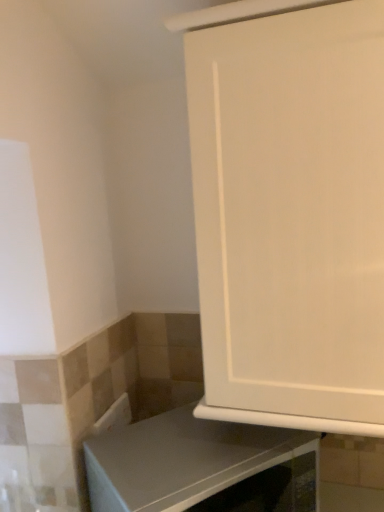
The width and height of the screenshot is (384, 512). What do you see at coordinates (201, 466) in the screenshot? I see `gray matte countertop at lower center` at bounding box center [201, 466].

Where is `gray matte countertop at lower center`? gray matte countertop at lower center is located at coordinates (201, 466).

What do you see at coordinates (289, 211) in the screenshot?
I see `white matte cabinet at center` at bounding box center [289, 211].

Where is `white matte cabinet at center`? The width and height of the screenshot is (384, 512). white matte cabinet at center is located at coordinates (289, 211).

This screenshot has width=384, height=512. Identify the location of gray matte countertop at lower center. (201, 466).

Considering the relative positions of gray matte countertop at lower center and white matte cabinet at center in the image provided, is gray matte countertop at lower center to the left or to the right of white matte cabinet at center?

Clearly, gray matte countertop at lower center is on the left of white matte cabinet at center in the image.

Does gray matte countertop at lower center come behind white matte cabinet at center?

Yes.

Does point (140, 481) come in front of point (268, 376)?

Yes, point (140, 481) is in front of point (268, 376).

From the image's perspective, is gray matte countertop at lower center on top of white matte cabinet at center?

No, from the image's perspective, gray matte countertop at lower center is not over white matte cabinet at center.

From a real-world perspective, is gray matte countertop at lower center positioned above or below white matte cabinet at center?

Clearly, from a real-world perspective, gray matte countertop at lower center is below white matte cabinet at center.

Does gray matte countertop at lower center have a greater width compared to white matte cabinet at center?

No.

Which of these two, gray matte countertop at lower center or white matte cabinet at center, stands taller?

white matte cabinet at center.

Can you confirm if gray matte countertop at lower center is smaller than white matte cabinet at center?

Yes, gray matte countertop at lower center is smaller than white matte cabinet at center.

Is white matte cabinet at center inside gray matte countertop at lower center?

No, gray matte countertop at lower center does not contain white matte cabinet at center.

Is gray matte countertop at lower center next to white matte cabinet at center and touching it?

gray matte countertop at lower center is not next to white matte cabinet at center, and they're not touching.

Does gray matte countertop at lower center turn towards white matte cabinet at center?

No, gray matte countertop at lower center is not oriented towards white matte cabinet at center.

How different are the orientations of gray matte countertop at lower center and white matte cabinet at center in degrees?

The angle between the facing direction of gray matte countertop at lower center and the facing direction of white matte cabinet at center is 49.7 degrees.

Locate an element on the screen. cabinetry above the gray matte countertop at lower center (from a real-world perspective) is located at coordinates (289, 211).

Is white matte cabinet at center at the left side of gray matte countertop at lower center?

No, white matte cabinet at center is not to the left of gray matte countertop at lower center.

Looking at this image, which is in front, white matte cabinet at center or gray matte countertop at lower center?

white matte cabinet at center is more forward.

Is point (317, 77) positioned in front of point (204, 445)?

Yes, point (317, 77) is in front of point (204, 445).

From the image's perspective, is white matte cabinet at center on top of gray matte countertop at lower center?

Yes, from the image's perspective, white matte cabinet at center is above gray matte countertop at lower center.

Consider the image. From a real-world perspective, which is physically above, white matte cabinet at center or gray matte countertop at lower center?

white matte cabinet at center, from a real-world perspective.

In the scene shown: Between white matte cabinet at center and gray matte countertop at lower center, which one has larger width?

white matte cabinet at center is wider.

Considering the sizes of objects white matte cabinet at center and gray matte countertop at lower center in the image provided, who is taller, white matte cabinet at center or gray matte countertop at lower center?

Standing taller between the two is white matte cabinet at center.

Consider the image. Considering the sizes of objects white matte cabinet at center and gray matte countertop at lower center in the image provided, who is smaller, white matte cabinet at center or gray matte countertop at lower center?

gray matte countertop at lower center.

Would you say gray matte countertop at lower center is part of white matte cabinet at center's contents?

No, white matte cabinet at center does not contain gray matte countertop at lower center.

Is white matte cabinet at center beside gray matte countertop at lower center?

No, white matte cabinet at center is not next to gray matte countertop at lower center.

Does white matte cabinet at center turn towards gray matte countertop at lower center?

No, white matte cabinet at center is not aimed at gray matte countertop at lower center.

What's the angular difference between white matte cabinet at center and gray matte countertop at lower center's facing directions?

There is a 49.7-degree angle between the facing directions of white matte cabinet at center and gray matte countertop at lower center.

I want to click on cabinetry above the gray matte countertop at lower center (from the image's perspective), so click(x=289, y=211).

The width and height of the screenshot is (384, 512). In order to click on countertop to the left of white matte cabinet at center in this screenshot , I will do `click(201, 466)`.

Image resolution: width=384 pixels, height=512 pixels. Identify the location of cabinetry that is above the gray matte countertop at lower center (from the image's perspective). (289, 211).